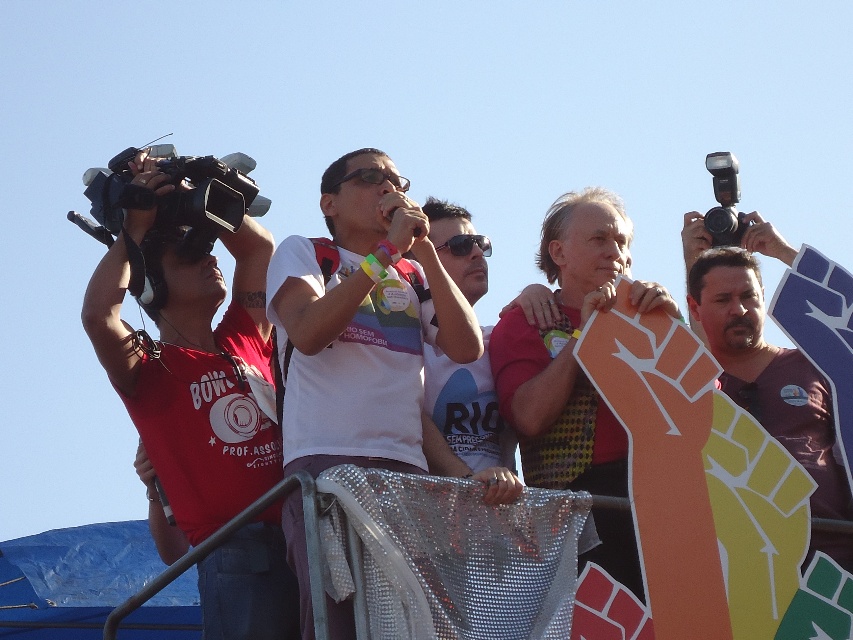
Question: Estimate the real-world distances between objects in this image. Which object is closer to the black plastic sunglasses at center?

Choices:
 (A) black plastic video camera at upper right
 (B) white t-shirt at center

Answer: (A)

Question: Can you confirm if white t-shirt at center is positioned above black plastic sunglasses at center?

Choices:
 (A) yes
 (B) no

Answer: (B)

Question: Among these objects, which one is farthest from the camera?

Choices:
 (A) clear plastic goggles at center
 (B) matte brown shirt at center
 (C) matte red tank top at left

Answer: (A)

Question: Among these points, which one is farthest from the camera?

Choices:
 (A) (727, 164)
 (B) (456, 243)
 (C) (368, 236)
 (D) (256, 536)

Answer: (A)

Question: Does clear plastic goggles at center appear on the left side of black plastic sunglasses at center?

Choices:
 (A) yes
 (B) no

Answer: (A)

Question: Can you confirm if clear plastic goggles at center is positioned to the right of black plastic sunglasses at center?

Choices:
 (A) no
 (B) yes

Answer: (A)